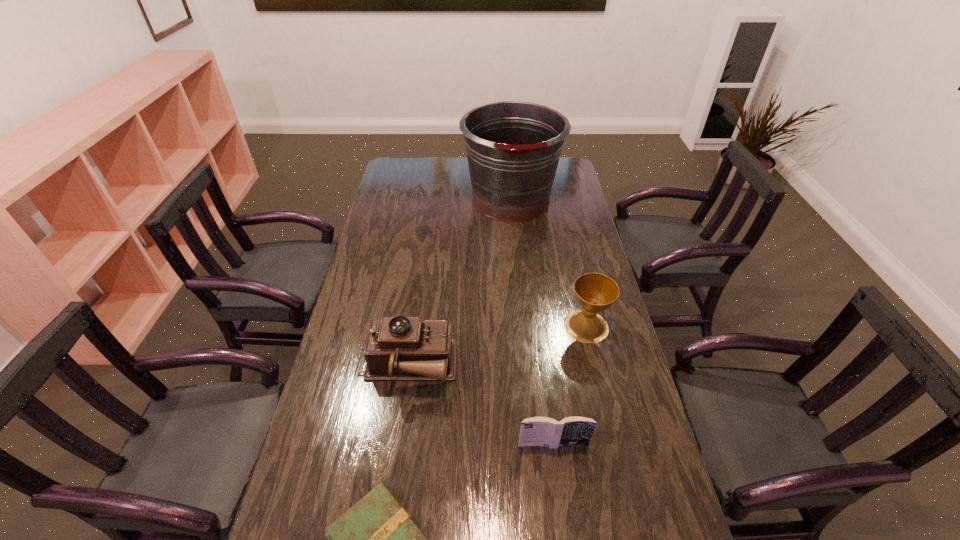
This screenshot has height=540, width=960. In order to click on vacant space at the far right corner of the desktop in this screenshot , I will do `click(566, 172)`.

Image resolution: width=960 pixels, height=540 pixels. I want to click on free space between the bucket and the chalice, so click(548, 263).

In order to click on vacant area between the phonograph_record and the taller book in this screenshot , I will do `click(480, 406)`.

This screenshot has width=960, height=540. What are the coordinates of `vacant area that lies between the chalice and the farthest object` in the screenshot? It's located at (548, 263).

Find the location of a particular element. free space that is in between the farther book and the chalice is located at coordinates (569, 386).

Identify the location of vacant space that is in between the bucket and the phonograph_record. The height and width of the screenshot is (540, 960). (459, 284).

Find the location of `free space between the chalice and the farther book`. free space between the chalice and the farther book is located at coordinates (569, 386).

Find the location of `the third closest object relative to the left book`. the third closest object relative to the left book is located at coordinates (595, 292).

The image size is (960, 540). What are the coordinates of `object that is the second closest one to the tallest object` in the screenshot? It's located at (400, 348).

Identify which book is the second nearest to the phonograph_record. Please provide its 2D coordinates. Your answer should be formatted as a tuple, i.e. [(x, y)], where the tuple contains the x and y coordinates of a point satisfying the conditions above.

[(376, 539)]